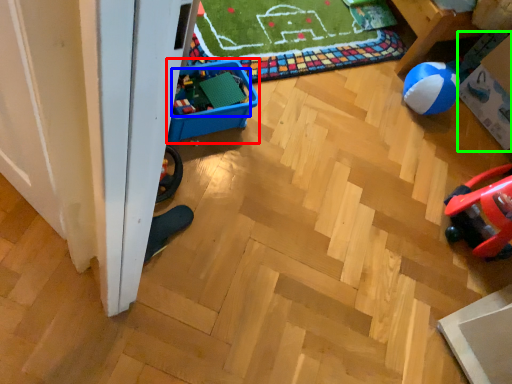
Question: Which object is the closest to the storage box (highlighted by a red box)? Choose among these: toy (highlighted by a blue box) or storage box (highlighted by a green box).

Choices:
 (A) toy
 (B) storage box

Answer: (A)